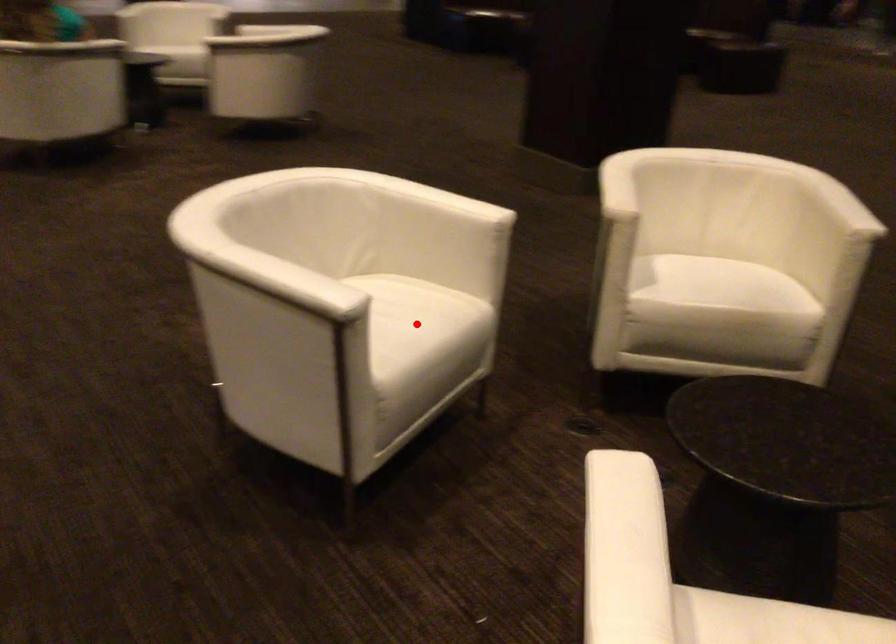
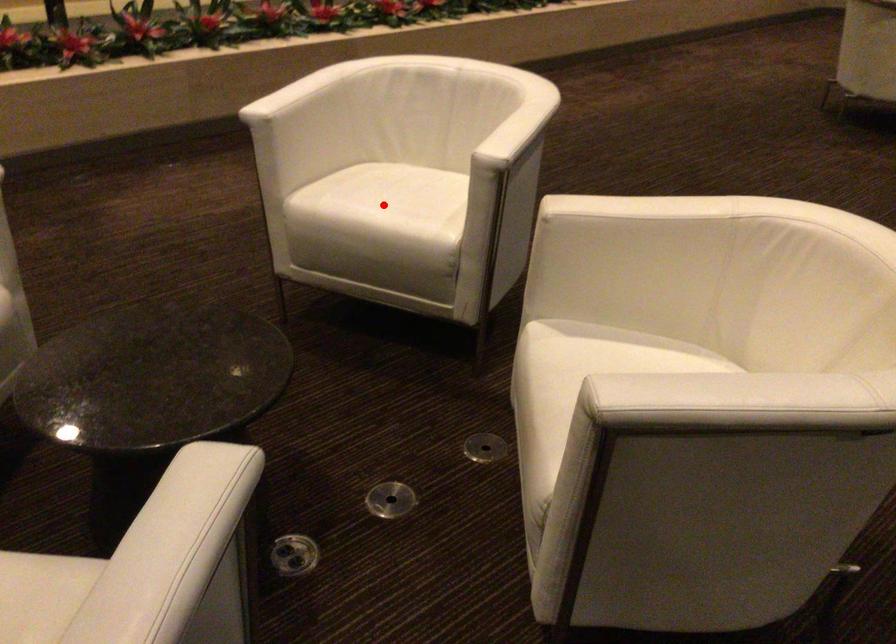
I am providing you with two images of the same scene from different viewpoints. A red point is marked on the first image and another point is marked on the second image. Are the points marked in image1 and image2 representing the same 3D position?

Yes